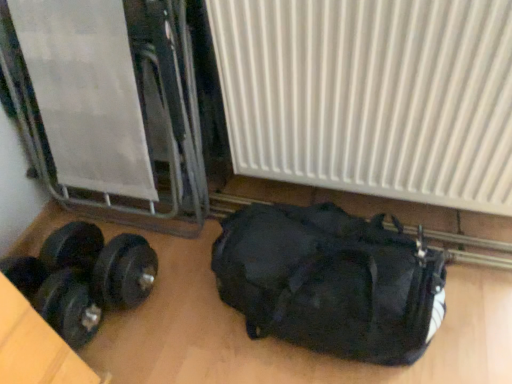
Question: From a real-world perspective, is black rubber dumbbell at lower left above or below white ribbed radiator at center?

Choices:
 (A) below
 (B) above

Answer: (A)

Question: Does point (71, 316) appear closer or farther from the camera than point (394, 21)?

Choices:
 (A) farther
 (B) closer

Answer: (A)

Question: Which object is the closest to the black matte duffel bag at lower right?

Choices:
 (A) white ribbed radiator at center
 (B) black rubber dumbbell at lower left

Answer: (A)

Question: Which object is positioned farthest from the black rubber dumbbell at lower left?

Choices:
 (A) black matte duffel bag at lower right
 (B) white ribbed radiator at center

Answer: (B)